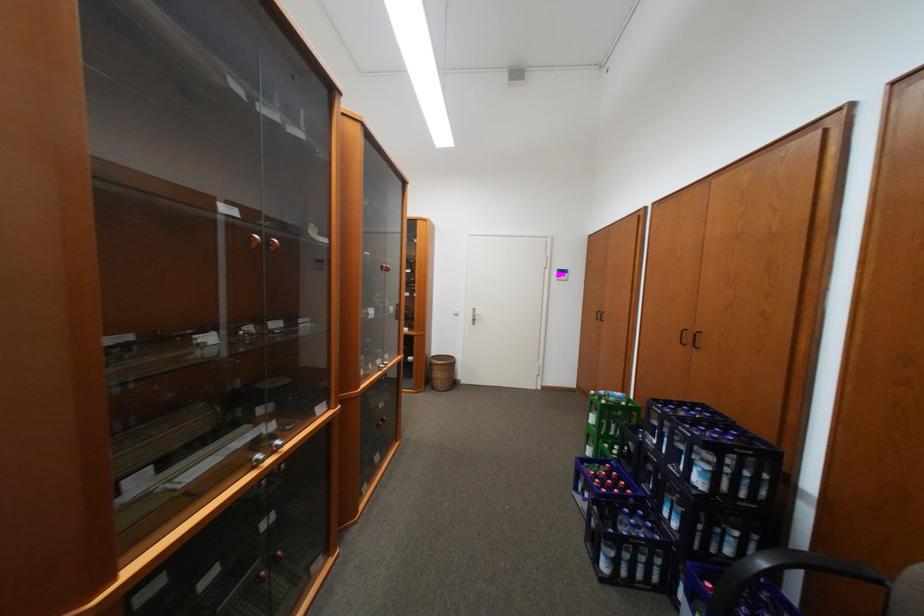
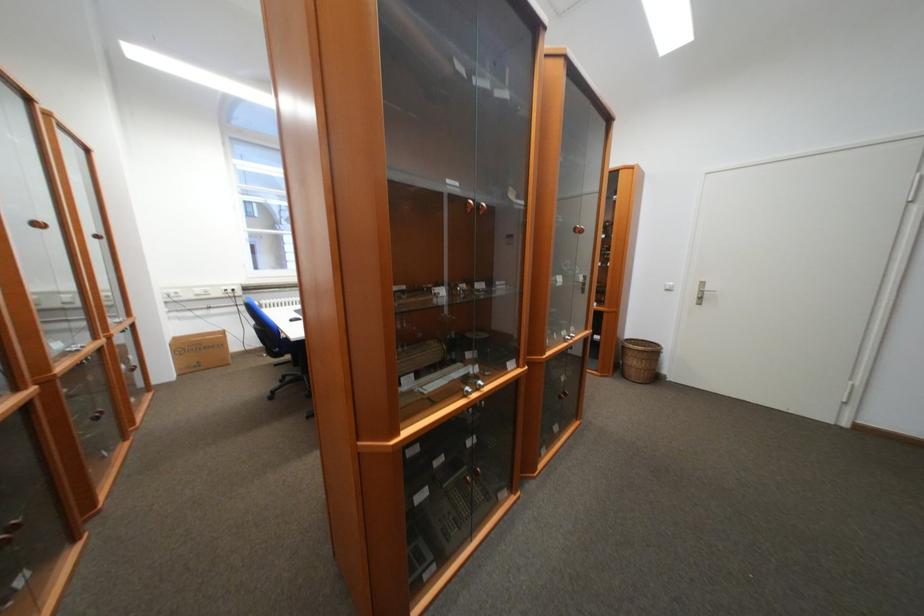
Question: The camera is either moving clockwise (left) or counter-clockwise (right) around the object. The first image is from the beginning of the video and the second image is from the end. Is the camera moving left or right when shooting the video?

Choices:
 (A) Left
 (B) Right

Answer: (B)